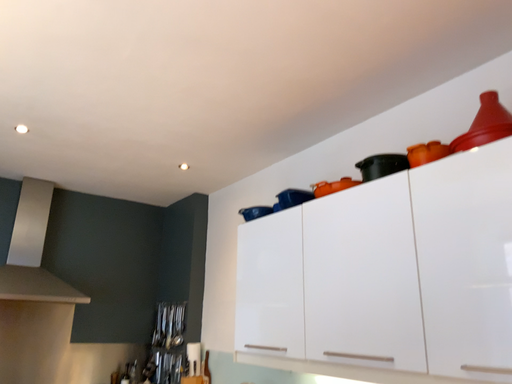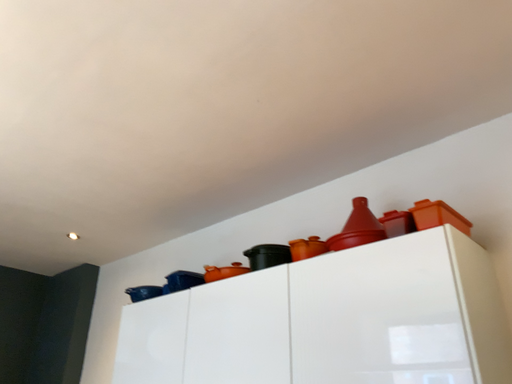
Question: How did the camera likely rotate when shooting the video?

Choices:
 (A) rotated left
 (B) rotated right

Answer: (B)